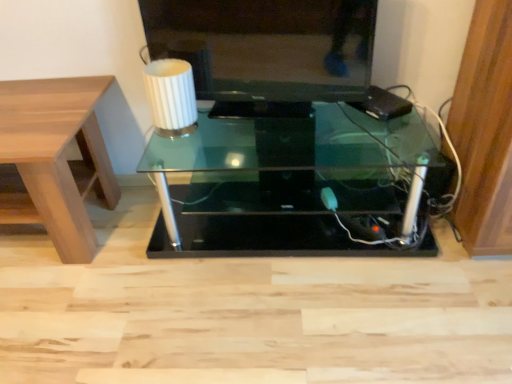
Question: Is matte black television at upper center wider than transparent glass table at center, which is the 1th table in right-to-left order?

Choices:
 (A) no
 (B) yes

Answer: (A)

Question: Is matte black television at upper center thinner than transparent glass table at center, which is the 1th table in right-to-left order?

Choices:
 (A) no
 (B) yes

Answer: (B)

Question: Does matte black television at upper center have a lesser height compared to transparent glass table at center, which is the 1th table in right-to-left order?

Choices:
 (A) no
 (B) yes

Answer: (B)

Question: From a real-world perspective, is matte black television at upper center under transparent glass table at center, which is the 1th table in right-to-left order?

Choices:
 (A) yes
 (B) no

Answer: (B)

Question: Is matte black television at upper center outside of transparent glass table at center, which is counted as the second table, starting from the left?

Choices:
 (A) yes
 (B) no

Answer: (A)

Question: From the image's perspective, is matte black television at upper center above or below transparent glass table at center, which is counted as the second table, starting from the left?

Choices:
 (A) below
 (B) above

Answer: (B)

Question: Based on their positions, is matte black television at upper center located to the left or right of transparent glass table at center, which is the 1th table in right-to-left order?

Choices:
 (A) left
 (B) right

Answer: (A)

Question: Considering the positions of point (230, 16) and point (387, 231), is point (230, 16) closer or farther from the camera than point (387, 231)?

Choices:
 (A) closer
 (B) farther

Answer: (A)

Question: Do you think matte black television at upper center is within transparent glass table at center, which is the 1th table in right-to-left order, or outside of it?

Choices:
 (A) inside
 (B) outside

Answer: (B)

Question: Visually, is transparent glass table at center, which is counted as the second table, starting from the left, positioned to the left or to the right of light brown wood table at left, the second table viewed from the right?

Choices:
 (A) left
 (B) right

Answer: (B)

Question: Is point (226, 206) positioned closer to the camera than point (52, 110)?

Choices:
 (A) farther
 (B) closer

Answer: (A)

Question: From a real-world perspective, is transparent glass table at center, which is counted as the second table, starting from the left, above or below light brown wood table at left, the 1th table viewed from the left?

Choices:
 (A) below
 (B) above

Answer: (A)

Question: Relative to light brown wood table at left, the second table viewed from the right, is transparent glass table at center, which is the 1th table in right-to-left order, in front or behind?

Choices:
 (A) behind
 (B) front

Answer: (A)

Question: From a real-world perspective, is white ribbed glass at upper center above or below light brown wood table at left, the second table viewed from the right?

Choices:
 (A) below
 (B) above

Answer: (B)

Question: Would you say white ribbed glass at upper center is to the left or to the right of light brown wood table at left, the second table viewed from the right, in the picture?

Choices:
 (A) left
 (B) right

Answer: (B)